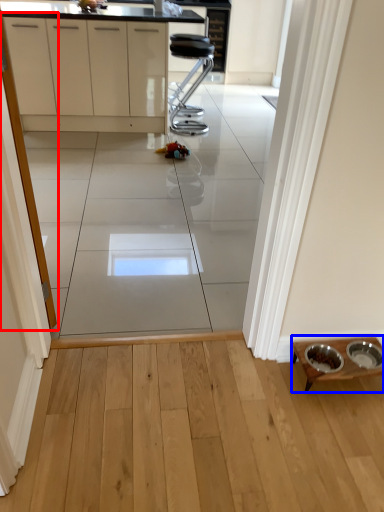
Question: Which point is closer to the camera, screen door (highlighted by a red box) or table (highlighted by a blue box)?

Choices:
 (A) screen door
 (B) table

Answer: (A)